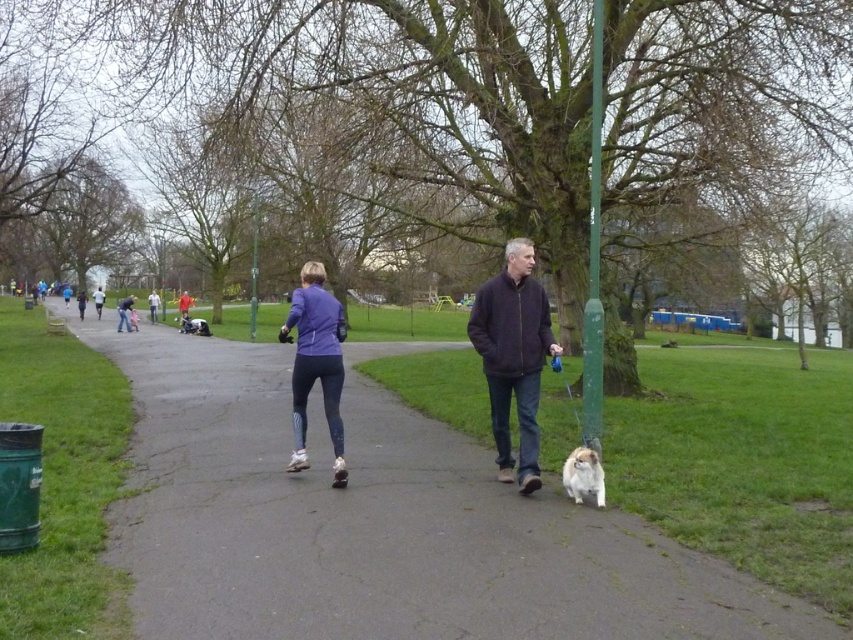
Who is lower down, smooth asphalt path at center or matte purple jacket at center?

Positioned lower is smooth asphalt path at center.

Who is shorter, smooth asphalt path at center or matte purple jacket at center?

smooth asphalt path at center

Image resolution: width=853 pixels, height=640 pixels. Describe the element at coordinates (376, 522) in the screenshot. I see `smooth asphalt path at center` at that location.

What are the coordinates of `smooth asphalt path at center` in the screenshot? It's located at (376, 522).

Does dark brown fleece at center lie behind fluffy white dog at lower center?

Yes, it is.

At what (x,y) coordinates should I click in order to perform the action: click on dark brown fleece at center. Please return your answer as a coordinate pair (x, y). The image size is (853, 640). Looking at the image, I should click on (514, 356).

Is green matte pole at right positioned before fluffy white dog at lower center?

No, it is behind fluffy white dog at lower center.

Between point (593, 100) and point (585, 477), which one is positioned behind?

Positioned behind is point (593, 100).

Does point (598, 154) come farther from viewer compared to point (592, 476)?

Yes.

Identify the location of green matte pole at right. pyautogui.click(x=593, y=257).